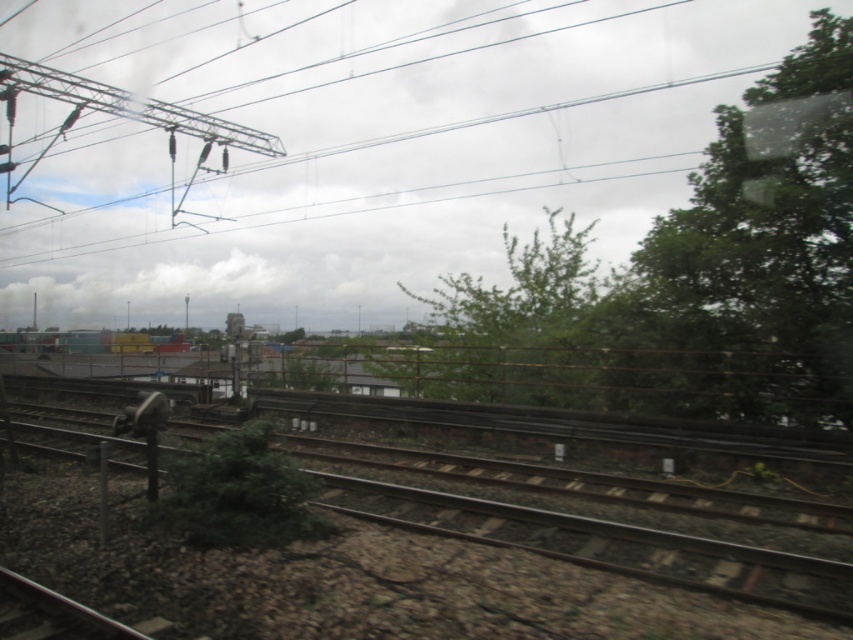
Question: Does metallic wire at upper center come behind green leafy tree at center?

Choices:
 (A) yes
 (B) no

Answer: (A)

Question: Which object is positioned farthest from the green matte train at lower left?

Choices:
 (A) metallic train track at lower left
 (B) green leafy tree at center

Answer: (A)

Question: Is green leafy tree at center smaller than metallic train track at lower left?

Choices:
 (A) no
 (B) yes

Answer: (A)

Question: From the image, what is the correct spatial relationship of metallic train track at lower left in relation to green matte train at lower left?

Choices:
 (A) left
 (B) right

Answer: (B)

Question: Which point is closer to the camera taking this photo?

Choices:
 (A) (498, 321)
 (B) (123, 236)
 (C) (86, 552)

Answer: (C)

Question: Which point is farther to the camera?

Choices:
 (A) (88, 234)
 (B) (430, 516)
 (C) (77, 344)
 (D) (733, 262)

Answer: (A)